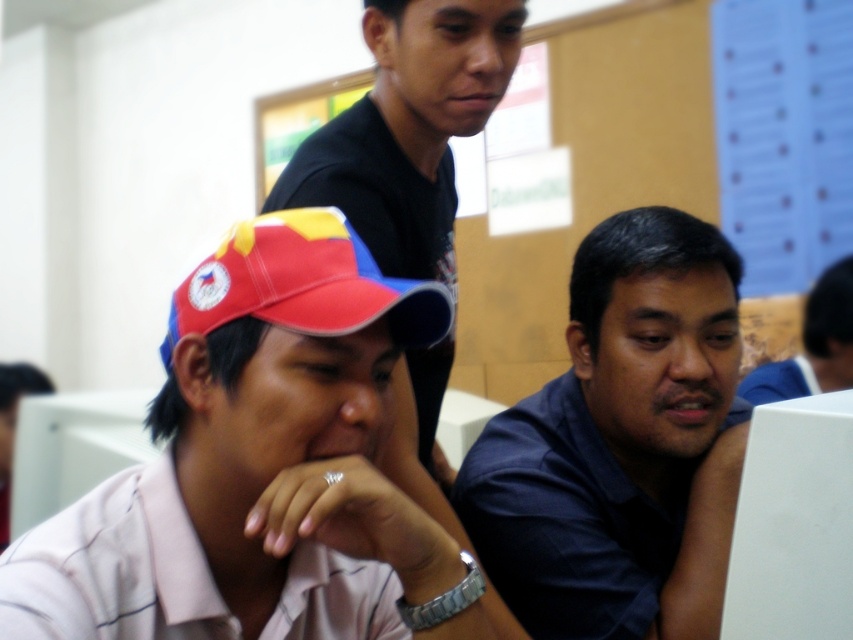
Question: Which point is farther from the camera taking this photo?

Choices:
 (A) (250, 362)
 (B) (466, 49)
 (C) (267, 321)
 (D) (700, 435)

Answer: (B)

Question: Which object is positioned farthest from the red fabric cap at lower left?

Choices:
 (A) matte pink shirt at center
 (B) matte black shirt at upper center

Answer: (B)

Question: Does dark blue shirt at center appear under matte black shirt at upper center?

Choices:
 (A) yes
 (B) no

Answer: (A)

Question: Is dark blue shirt at center bigger than red fabric cap at lower left?

Choices:
 (A) no
 (B) yes

Answer: (B)

Question: Which object is closer to the camera taking this photo?

Choices:
 (A) matte black shirt at upper center
 (B) dark blue shirt at center
 (C) matte pink shirt at center

Answer: (C)

Question: Can you confirm if matte pink shirt at center is positioned to the right of red fabric cap at lower left?

Choices:
 (A) no
 (B) yes

Answer: (B)